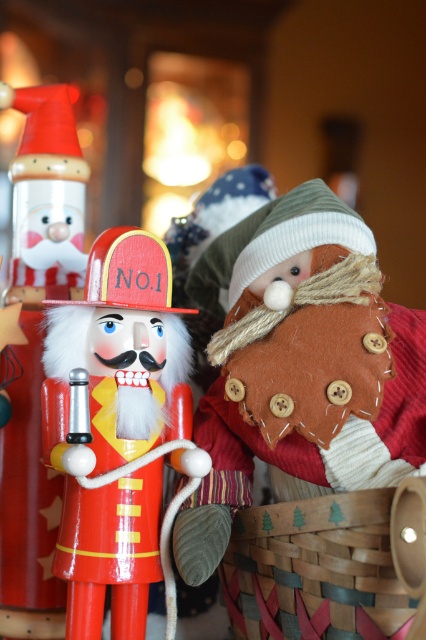
Can you confirm if brown felt santa at center is thinner than shiny red wood nutcracker at center?

No.

Which is more to the right, brown felt santa at center or shiny red wood nutcracker at center?

brown felt santa at center is more to the right.

Which is in front, point (299, 257) or point (103, 275)?

Point (103, 275) is more forward.

Locate an element on the screen. This screenshot has width=426, height=640. brown felt santa at center is located at coordinates (299, 369).

Can you confirm if brown felt santa at center is positioned to the left of woven wood basket at lower right?

Yes, brown felt santa at center is to the left of woven wood basket at lower right.

From the picture: Can you confirm if brown felt santa at center is positioned below woven wood basket at lower right?

No, brown felt santa at center is not below woven wood basket at lower right.

The height and width of the screenshot is (640, 426). Identify the location of brown felt santa at center. (299, 369).

This screenshot has height=640, width=426. I want to click on brown felt santa at center, so click(299, 369).

Who is more distant from viewer, (31, 426) or (319, 548)?

Point (31, 426)

You are a GUI agent. You are given a task and a screenshot of the screen. Output one action in this format:
    pyautogui.click(x=<x>, y=<y>)
    Task: Click on the wooden nutcracker at left
    
    Given the screenshot: What is the action you would take?
    pyautogui.click(x=36, y=353)